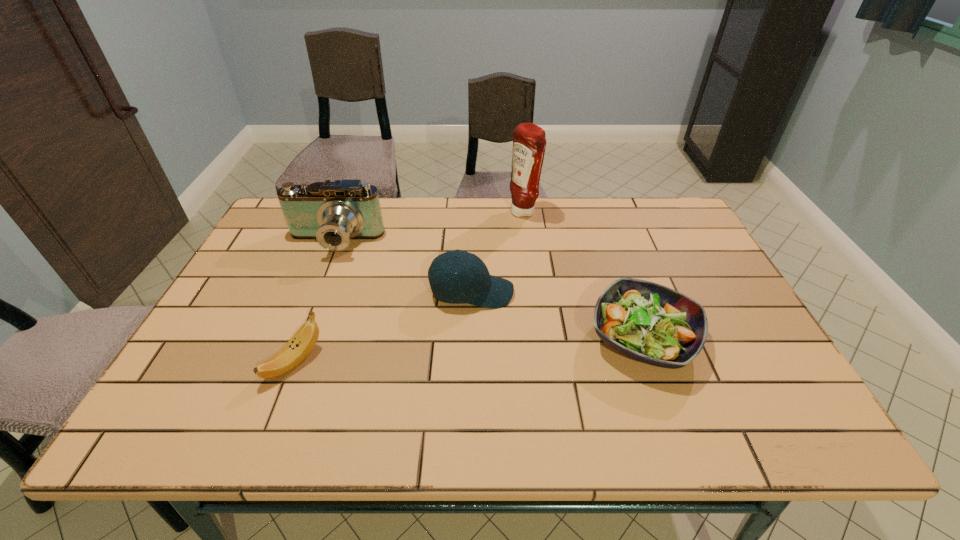
Where is `vacant region at the left edge of the desktop`? vacant region at the left edge of the desktop is located at coordinates (271, 247).

This screenshot has width=960, height=540. In the image, there is a desktop. Identify the location of vacant space at the near right corner. (756, 426).

Locate an element on the screen. The image size is (960, 540). blank region between the farthest object and the banana is located at coordinates (409, 287).

Identify the location of vacant area between the second tallest object and the banana. (314, 302).

The width and height of the screenshot is (960, 540). Find the location of `free spot between the farthest object and the banana`. free spot between the farthest object and the banana is located at coordinates (409, 287).

At what (x,y) coordinates should I click in order to perform the action: click on free space between the banana and the farthest object. Please return your answer as a coordinate pair (x, y). Looking at the image, I should click on (409, 287).

Find the location of a particular element. This screenshot has width=960, height=540. free space that is in between the baseball cap and the condiment is located at coordinates coord(497,252).

This screenshot has width=960, height=540. I want to click on vacant space that's between the second object from right to left and the banana, so click(409, 287).

You are a GUI agent. You are given a task and a screenshot of the screen. Output one action in this format:
    pyautogui.click(x=<x>, y=<y>)
    Task: Click on the free space that is in between the third shortest object and the banana
    Image resolution: width=960 pixels, height=540 pixels.
    Given the screenshot: What is the action you would take?
    pyautogui.click(x=383, y=327)

Image resolution: width=960 pixels, height=540 pixels. I want to click on free spot between the third object from left to right and the camcorder, so click(x=403, y=268).